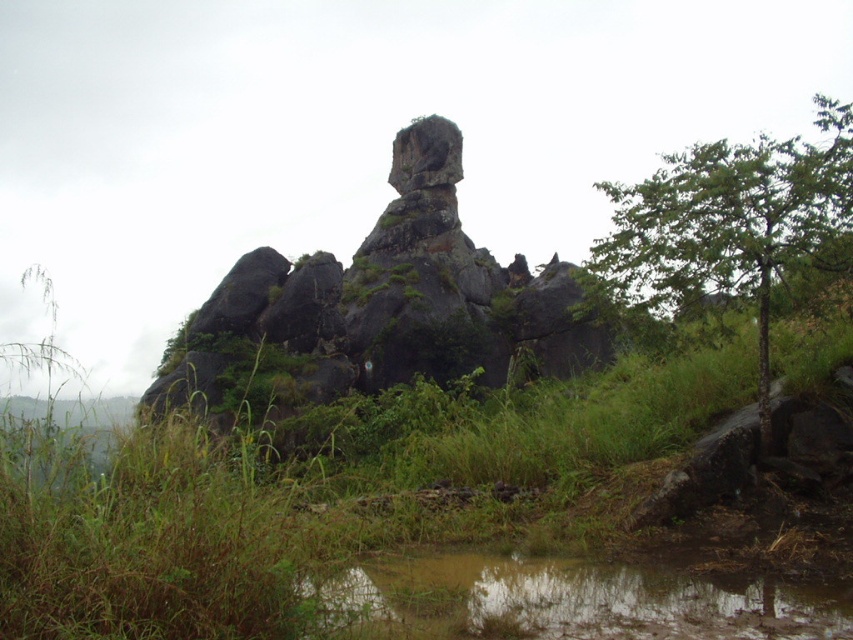
You are standing at point (415, 520) in the scene. What do you see directly in front of you?

At point (415, 520) lies green grassy at center.

You are standing in the natural landscape scene. You see the green grassy at center and the green leafy tree at right. Which object is closer to the ground?

The green grassy at center is closer to the ground because it is positioned under the green leafy tree at right.